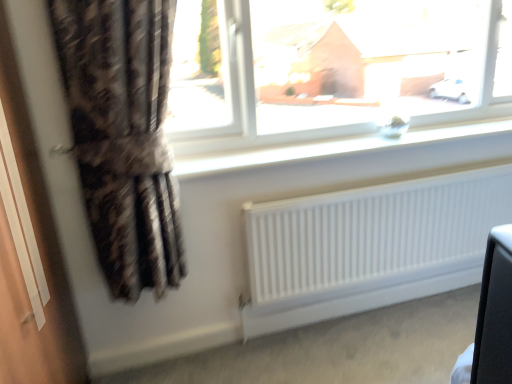
Question: Is white smooth window sill at upper center situated inside transparent glass window at upper center or outside?

Choices:
 (A) inside
 (B) outside

Answer: (B)

Question: Is point (196, 172) closer or farther from the camera than point (296, 18)?

Choices:
 (A) closer
 (B) farther

Answer: (A)

Question: Based on their relative distances, which object is farther from the white matte radiator at lower center?

Choices:
 (A) plaid fabric curtain at left
 (B) white smooth window sill at upper center
 (C) transparent glass window at upper center

Answer: (C)

Question: Which object is the closest to the white smooth window sill at upper center?

Choices:
 (A) white matte radiator at lower center
 (B) transparent glass window at upper center
 (C) plaid fabric curtain at left

Answer: (A)